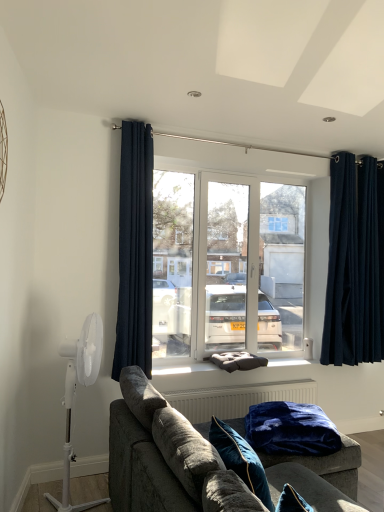
Question: Is white plastic mechanical fan at left not near velvet blue blanket at lower center?

Choices:
 (A) no
 (B) yes

Answer: (B)

Question: Is white plastic mechanical fan at left placed right next to velvet blue blanket at lower center?

Choices:
 (A) yes
 (B) no

Answer: (B)

Question: Can you confirm if white plastic mechanical fan at left is wider than velvet blue blanket at lower center?

Choices:
 (A) no
 (B) yes

Answer: (A)

Question: Is white plastic mechanical fan at left in front of velvet blue blanket at lower center?

Choices:
 (A) no
 (B) yes

Answer: (B)

Question: Is white plastic mechanical fan at left taller than velvet blue blanket at lower center?

Choices:
 (A) no
 (B) yes

Answer: (B)

Question: Considering the positions of navy blue velvet curtains at right, arranged as the first curtain when viewed from the right, and white glossy door at center in the image, is navy blue velvet curtains at right, arranged as the first curtain when viewed from the right, wider or thinner than white glossy door at center?

Choices:
 (A) wide
 (B) thin

Answer: (A)

Question: From a real-world perspective, is navy blue velvet curtains at right, which ranks as the first curtain in back-to-front order, physically located above or below white glossy door at center?

Choices:
 (A) above
 (B) below

Answer: (A)

Question: Which is correct: navy blue velvet curtains at right, which ranks as the first curtain in back-to-front order, is inside white glossy door at center, or outside of it?

Choices:
 (A) outside
 (B) inside

Answer: (A)

Question: Considering the relative positions of navy blue velvet curtains at right, which ranks as the first curtain in back-to-front order, and white glossy door at center in the image provided, is navy blue velvet curtains at right, which ranks as the first curtain in back-to-front order, to the left or to the right of white glossy door at center?

Choices:
 (A) left
 (B) right

Answer: (B)

Question: From a real-world perspective, is navy blue velvet curtains at right, the 2th curtain from the front, positioned above or below dark fabric cushion at center?

Choices:
 (A) above
 (B) below

Answer: (A)

Question: Considering their positions, is navy blue velvet curtains at right, arranged as the second curtain when viewed from the left, located in front of or behind dark fabric cushion at center?

Choices:
 (A) behind
 (B) front

Answer: (A)

Question: Considering the positions of navy blue velvet curtains at right, the 2th curtain from the front, and dark fabric cushion at center in the image, is navy blue velvet curtains at right, the 2th curtain from the front, wider or thinner than dark fabric cushion at center?

Choices:
 (A) thin
 (B) wide

Answer: (A)

Question: From the image's perspective, is navy blue velvet curtains at right, arranged as the first curtain when viewed from the right, above or below dark fabric cushion at center?

Choices:
 (A) below
 (B) above

Answer: (B)

Question: Based on their sizes in the image, would you say white plastic mechanical fan at left is bigger or smaller than velvet gray couch at center?

Choices:
 (A) big
 (B) small

Answer: (B)

Question: From a real-world perspective, relative to velvet gray couch at center, is white plastic mechanical fan at left vertically above or below?

Choices:
 (A) below
 (B) above

Answer: (B)